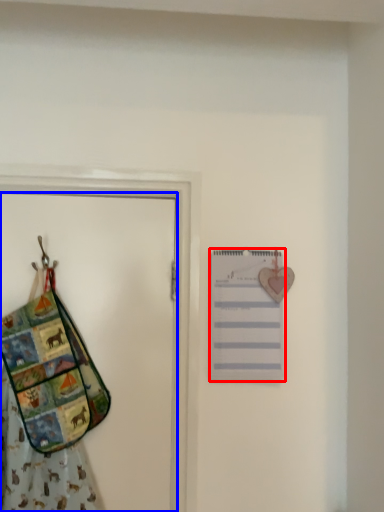
Question: Among these objects, which one is farthest to the camera, list (highlighted by a red box) or door (highlighted by a blue box)?

Choices:
 (A) list
 (B) door

Answer: (A)